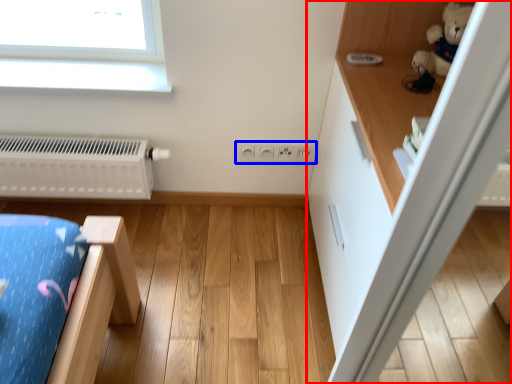
Question: Which object is closer to the camera taking this photo, dresser (highlighted by a red box) or electric outlet (highlighted by a blue box)?

Choices:
 (A) dresser
 (B) electric outlet

Answer: (A)